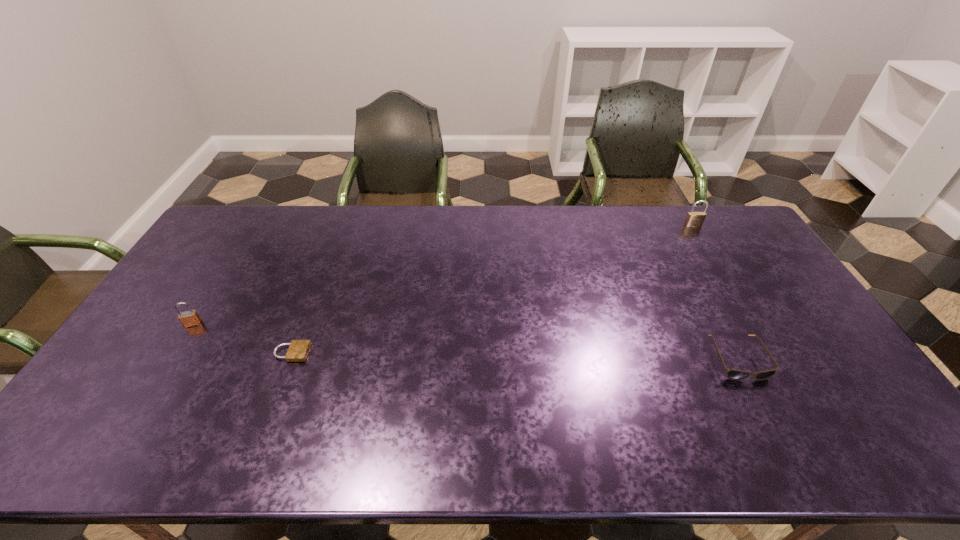
The width and height of the screenshot is (960, 540). What are the coordinates of `blank space located 0.270m on the keyhole side of the second padlock from right to left` in the screenshot? It's located at (407, 353).

At what (x,y) coordinates should I click in order to perform the action: click on object located in the far edge section of the desktop. Please return your answer as a coordinate pair (x, y). This screenshot has width=960, height=540. Looking at the image, I should click on (694, 219).

Identify the location of object present at the left edge. (189, 318).

Find the location of a particular element. The height and width of the screenshot is (540, 960). object present at the right edge is located at coordinates (694, 219).

Where is `object present at the far right corner`? object present at the far right corner is located at coordinates (694, 219).

In the image, there is a desktop. Identify the location of vacant space at the far edge. Image resolution: width=960 pixels, height=540 pixels. (553, 219).

Find the location of `free space at the near edge of the desktop`. free space at the near edge of the desktop is located at coordinates (755, 448).

I want to click on vacant point at the left edge, so click(240, 260).

Where is `free space at the right edge`? Image resolution: width=960 pixels, height=540 pixels. free space at the right edge is located at coordinates (781, 306).

In the image, there is a desktop. Identify the location of vacant region at the far left corner. Image resolution: width=960 pixels, height=540 pixels. (245, 219).